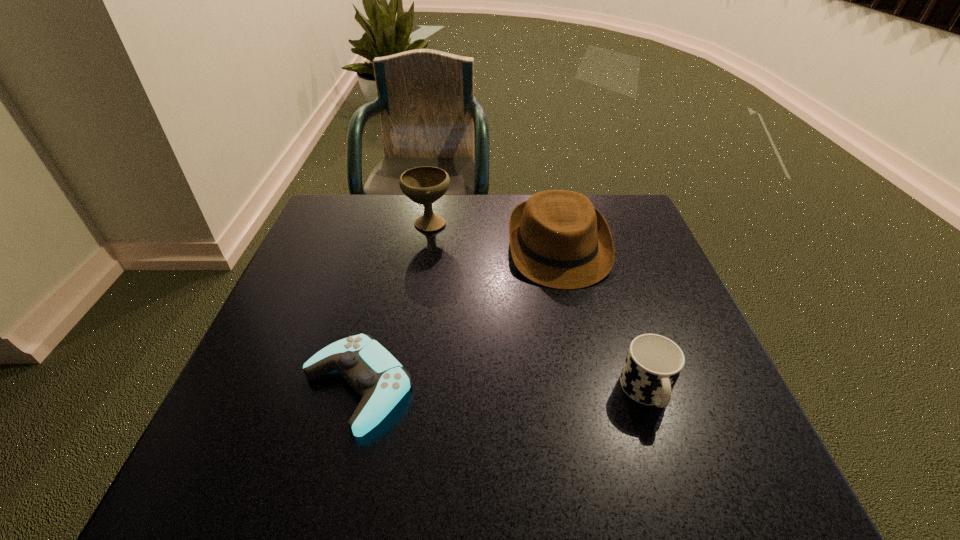
What are the coordinates of `object that is at the left edge` in the screenshot? It's located at (373, 372).

Find the location of `fedora located at the right edge`. fedora located at the right edge is located at coordinates (558, 239).

The image size is (960, 540). Identify the location of cup that is at the right edge. (653, 364).

Identify the location of object that is at the far right corner. Image resolution: width=960 pixels, height=540 pixels. (558, 239).

Locate an element on the screen. The height and width of the screenshot is (540, 960). vacant region at the far edge is located at coordinates (417, 215).

Where is `vacant space at the near edge of the desktop`? vacant space at the near edge of the desktop is located at coordinates (320, 473).

The height and width of the screenshot is (540, 960). I want to click on free space at the left edge of the desktop, so click(285, 330).

The image size is (960, 540). I want to click on vacant region at the right edge of the desktop, so click(737, 405).

Locate an element on the screen. Image resolution: width=960 pixels, height=540 pixels. vacant position at the far left corner of the desktop is located at coordinates (331, 204).

In the image, there is a desktop. Identify the location of vacant space at the near left corner. (187, 475).